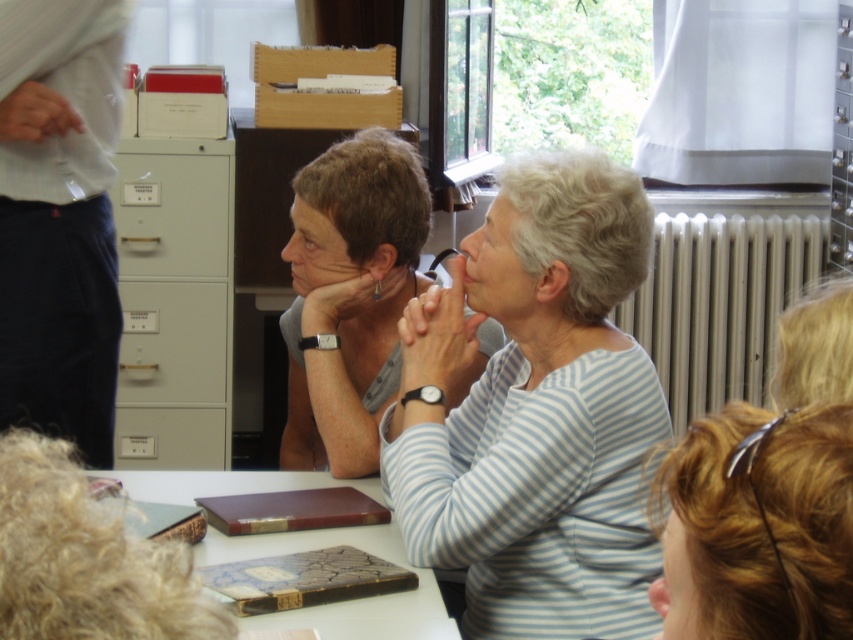
Question: Can you confirm if metallic radiator at right is positioned above gray matte file cabinet at left?

Choices:
 (A) yes
 (B) no

Answer: (B)

Question: Which point is closer to the camera?

Choices:
 (A) (292, 208)
 (B) (776, 289)

Answer: (A)

Question: Considering the real-world distances, which object is closest to the light blue striped shirt at center?

Choices:
 (A) brown leather book at center
 (B) gray matte file cabinet at left
 (C) matte gray filing cabinet at left

Answer: (A)

Question: Which point is farther to the camera?

Choices:
 (A) (345, 531)
 (B) (395, 337)
 (C) (192, 444)
 (D) (708, 515)

Answer: (C)

Question: Is gray matte file cabinet at left bigger than matte gray filing cabinet at left?

Choices:
 (A) no
 (B) yes

Answer: (B)

Question: Is blonde hair at upper right below gray matte file cabinet at left?

Choices:
 (A) yes
 (B) no

Answer: (A)